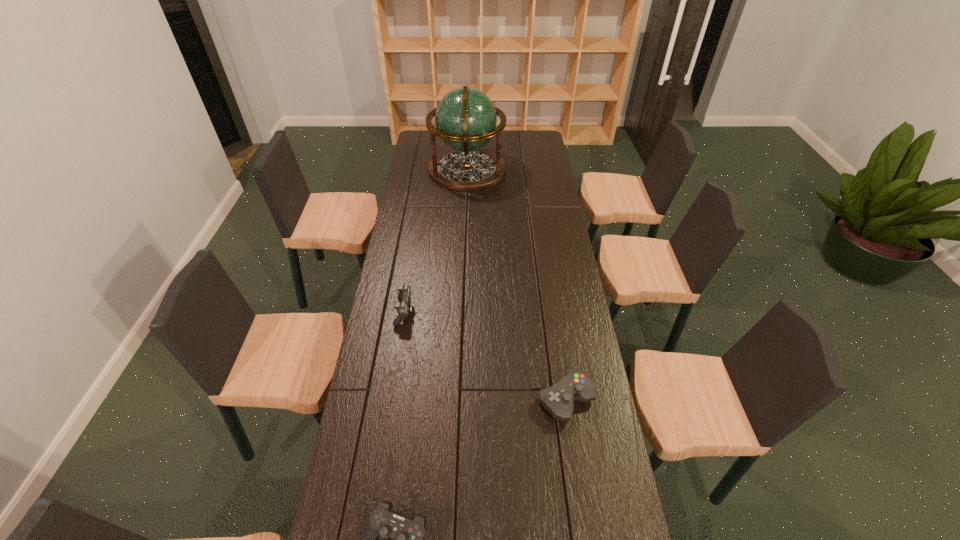
Where is `the farthest object`? the farthest object is located at coordinates (465, 119).

This screenshot has height=540, width=960. I want to click on globe, so click(x=465, y=119).

I want to click on the second farthest object, so click(x=404, y=295).

This screenshot has width=960, height=540. Find the location of `the tallest control`. the tallest control is located at coordinates (404, 295).

What are the coordinates of `the rightmost control` in the screenshot? It's located at (558, 400).

Locate an element on the screen. The image size is (960, 540). the third farthest object is located at coordinates (558, 400).

Locate an element on the screen. The height and width of the screenshot is (540, 960). vacant space located on the front-facing side of the tallest object is located at coordinates (547, 170).

At what (x,y) coordinates should I click in order to perform the action: click on vacant space located 0.150m on the surface of the tallest control with buttons. Please return your answer as a coordinate pair (x, y). The width and height of the screenshot is (960, 540). Looking at the image, I should click on (454, 312).

What are the coordinates of `free spot located 0.280m on the left of the second nearest control` in the screenshot? It's located at (447, 399).

In order to click on object present at the far edge in this screenshot , I will do `click(465, 119)`.